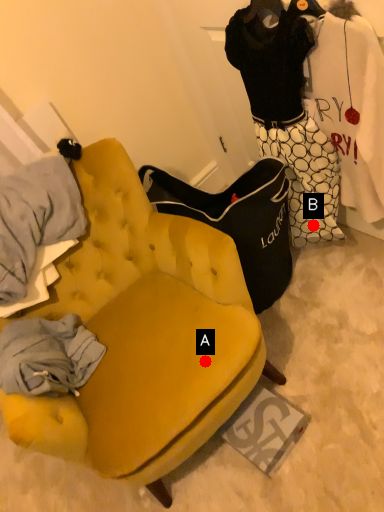
Question: Two points are circled on the image, labeled by A and B beside each circle. Which of the following is the closest to the observer?

Choices:
 (A) A is closer
 (B) B is closer

Answer: (A)